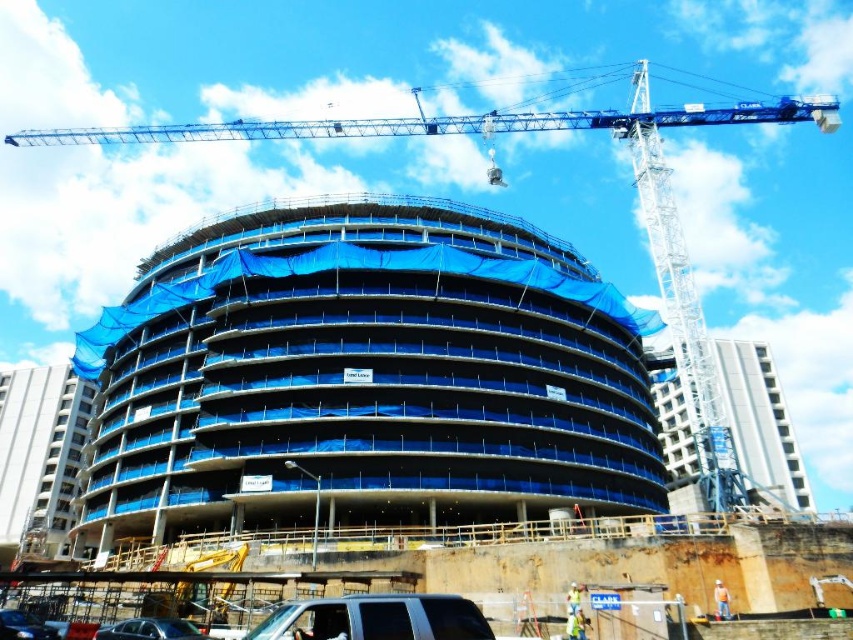
Question: Is matte black suv at lower center thinner than shiny black car at lower left?

Choices:
 (A) no
 (B) yes

Answer: (A)

Question: Which of the following is the closest to the observer?

Choices:
 (A) white fabric construction worker at lower center
 (B) white hard hat at lower right
 (C) metallic silver sedan at lower left

Answer: (C)

Question: Does blue metallic crane at upper center appear under white fabric construction worker at lower center?

Choices:
 (A) yes
 (B) no

Answer: (B)

Question: Which object appears farthest from the camera in this image?

Choices:
 (A) white fabric construction worker at lower center
 (B) metallic silver sedan at lower left

Answer: (A)

Question: Which point is closer to the camera?

Choices:
 (A) (277, 557)
 (B) (30, 636)
 (C) (469, 627)
 (D) (659, 122)

Answer: (C)

Question: In this image, where is metallic silver sedan at lower left located relative to white fabric construction worker at lower center?

Choices:
 (A) left
 (B) right

Answer: (A)